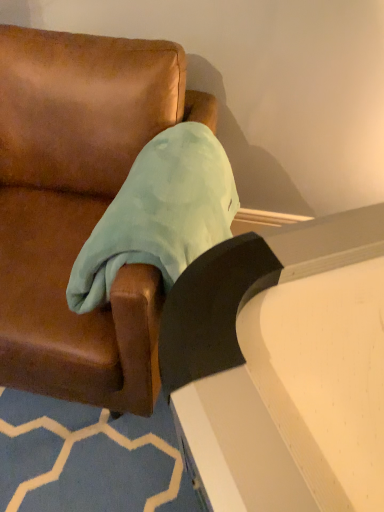
Locate an element on the screen. The height and width of the screenshot is (512, 384). matte brown leather chair at center is located at coordinates (79, 207).

What is the approximate width of matte brown leather chair at center?

matte brown leather chair at center is 38.53 inches in width.

Describe the element at coordinates (79, 207) in the screenshot. I see `matte brown leather chair at center` at that location.

In order to click on matte brown leather chair at center in this screenshot , I will do `click(79, 207)`.